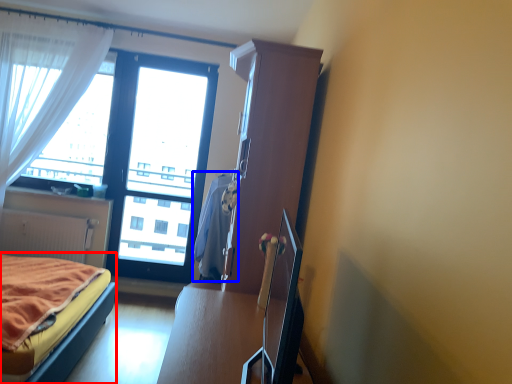
Question: Which of the following is the farthest to the observer, bed (highlighted by a red box) or blanket (highlighted by a blue box)?

Choices:
 (A) bed
 (B) blanket

Answer: (B)